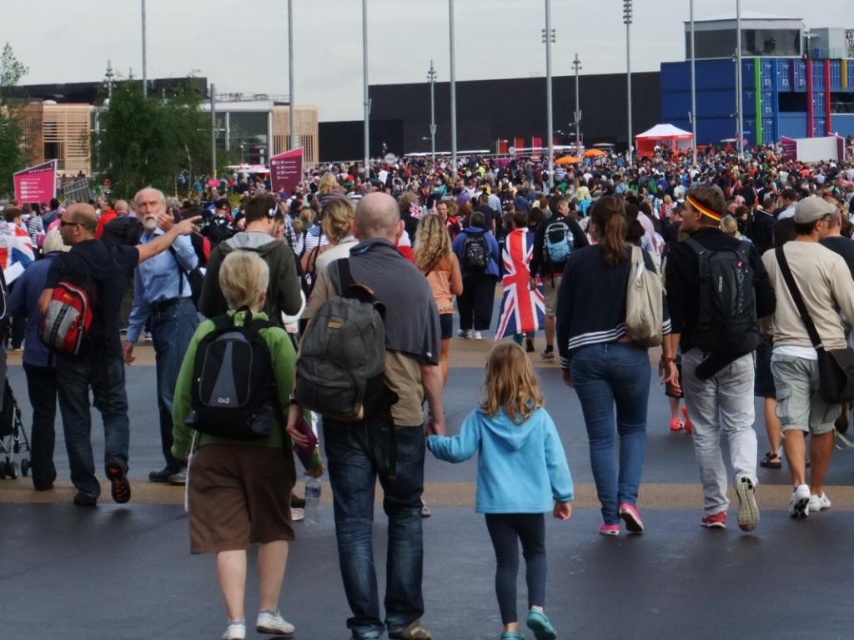
Does dark blue sweater at center have a greater height compared to white cotton t-shirt at center-right?

Yes.

Can you confirm if dark blue sweater at center is thinner than white cotton t-shirt at center-right?

No.

Is point (613, 490) positioned in front of point (802, 336)?

Yes.

This screenshot has width=854, height=640. I want to click on dark blue sweater at center, so click(605, 364).

The height and width of the screenshot is (640, 854). Find the location of `black matte backpack at center-left`. black matte backpack at center-left is located at coordinates (238, 442).

Between dark blue sweater at center and light blue fleece at center, which one has less height?

light blue fleece at center

Locate an element on the screen. Image resolution: width=854 pixels, height=640 pixels. dark blue sweater at center is located at coordinates (605, 364).

Does point (648, 372) come in front of point (527, 534)?

No, it is not.

Identify the location of dark blue sweater at center. coord(605,364).